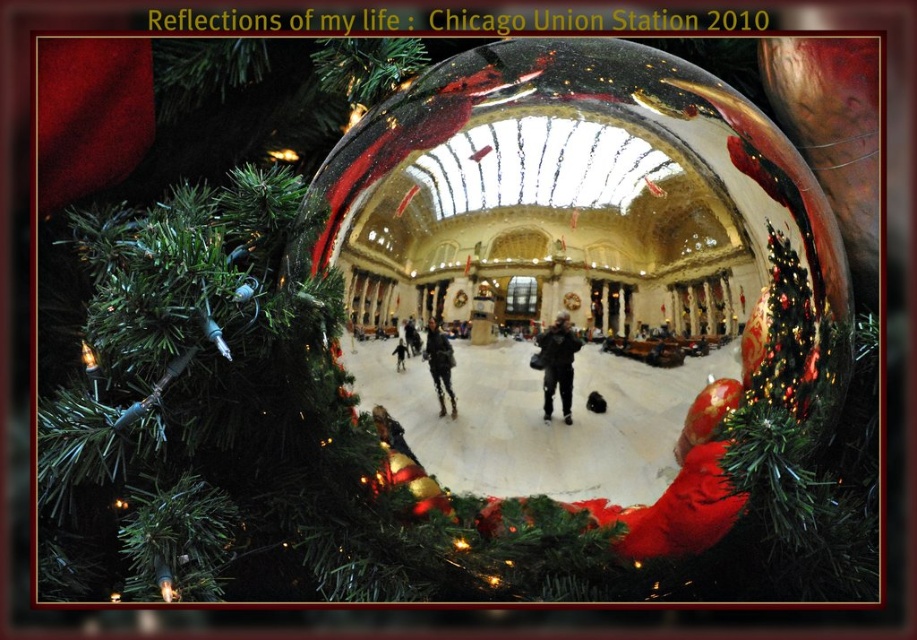
Question: From the image, what is the correct spatial relationship of dark gray fabric jacket at center in relation to matte black jacket at center?

Choices:
 (A) below
 (B) above

Answer: (B)

Question: Considering the relative positions of dark gray fabric jacket at center and matte black jacket at center in the image provided, where is dark gray fabric jacket at center located with respect to matte black jacket at center?

Choices:
 (A) right
 (B) left

Answer: (A)

Question: Is dark gray fabric jacket at center thinner than matte black jacket at center?

Choices:
 (A) no
 (B) yes

Answer: (A)